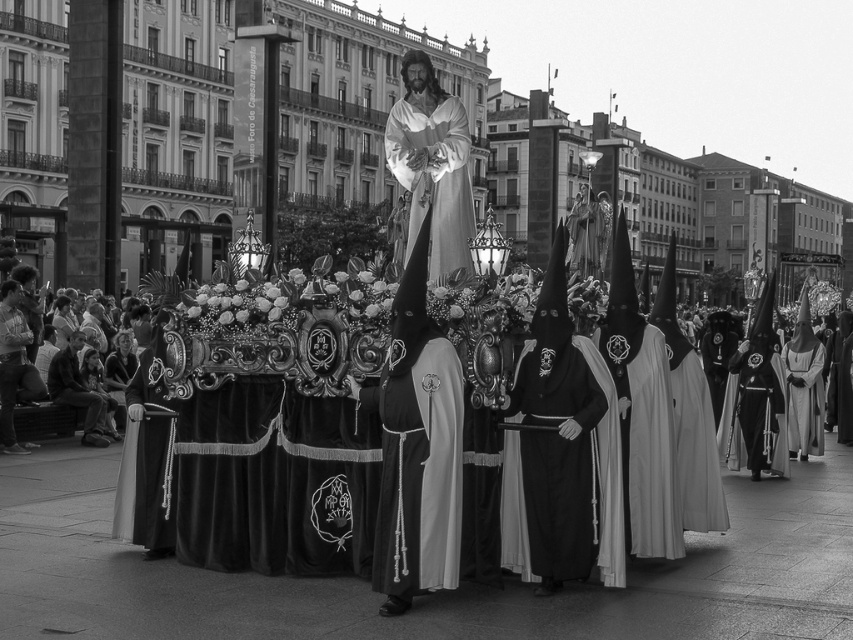
Based on the photo, you are standing in the plaza and want to take a photo of the point at coordinates (604, 372). If your camera has a focal length of 50mm and you are 21.07 meters away from the point, what is the angle of view required to frame the point perfectly in the center of your photo?

The point at coordinates (604, 372) is 21.07 meters from the viewer. To calculate the angle of view, use the formula angle of view in radians equals arctangent of object distance divided by focal length. However, since the point is a single coordinate, the angle of view required would be minimal, effectively zero, as a point has no dimensions. Thus, any standard camera setting with a 50mm focal length at that distance would easily capture the point in the frame.

You are standing in the plaza observing the religious procession. There are two points marked in the scene, one at coordinates point (428, 266) and another at point (122, 531). Which of these two points is closer to your viewpoint?

Point (122, 531) is closer to your viewpoint because it is less further away than point (428, 266).